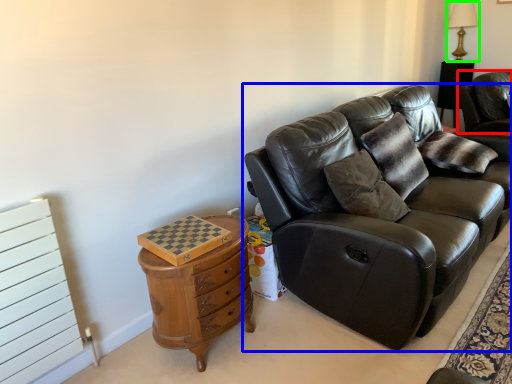
Question: Estimate the real-world distances between objects in this image. Which object is closer to chair (highlighted by a red box), studio couch (highlighted by a blue box) or table lamp (highlighted by a green box)?

Choices:
 (A) studio couch
 (B) table lamp

Answer: (B)